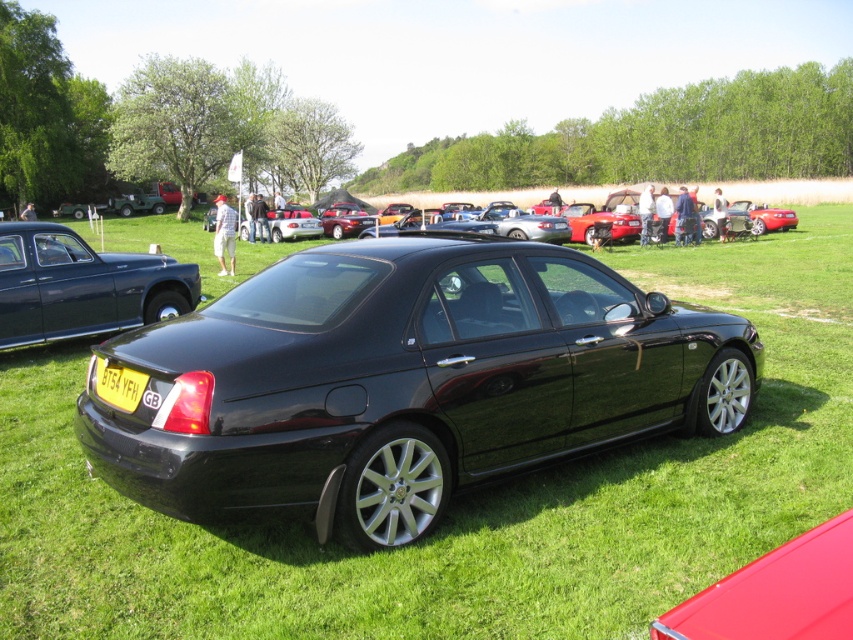
Looking at this image, you are a photographer at the car show and want to capture the glossy red car at center without the yellow matte license plate at center appearing in the background. Is this possible given their positions?

The glossy red car at center is in front of the yellow matte license plate at center, so if you position the camera to focus solely on the glossy red car at center, the license plate will not be visible in the background.

You are a photographer at the car show and want to take a photo of the glossy red car at center and the yellow matte license plate at center. Which object should you focus on first if you want to capture both in sharp focus?

The glossy red car at center is shorter than the yellow matte license plate at center, so you should focus on the glossy red car at center first to ensure both are in sharp focus.